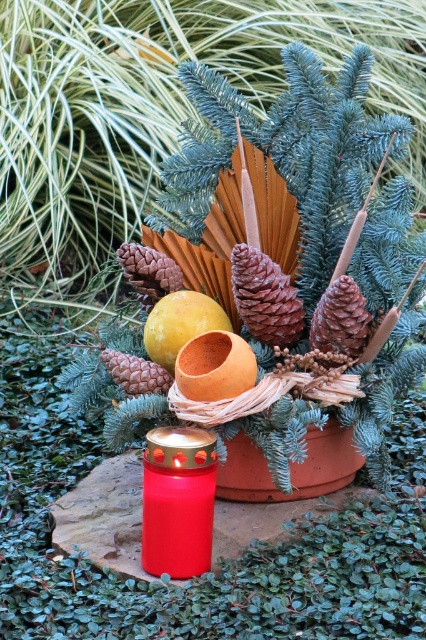
You are a gardener who wants to place a new decoration exactly at the same position as the orange matte bowl at center. What are the coordinates where you should place it?

The orange matte bowl at center should be placed at coordinates point (215, 365).